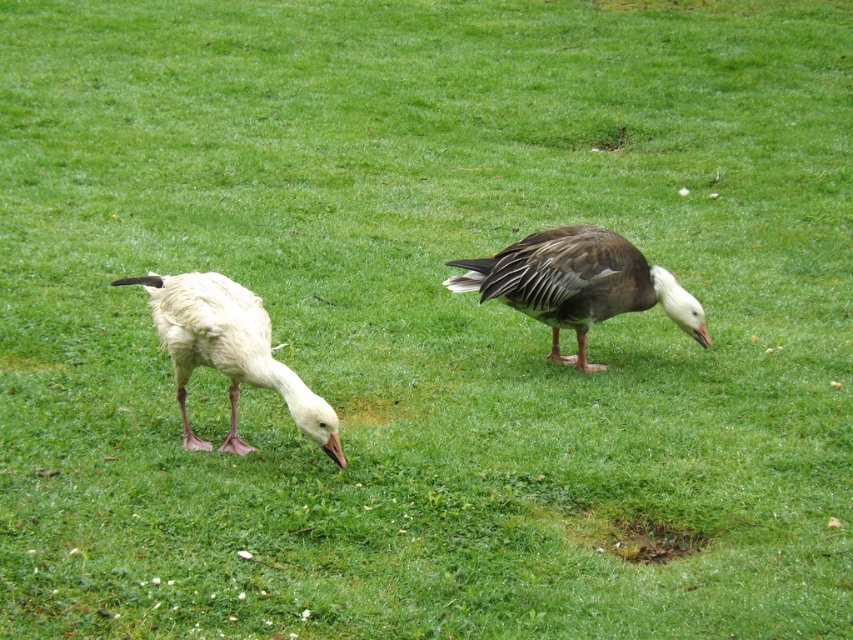
Question: Which object is farther from the camera taking this photo?

Choices:
 (A) white matte goose at left
 (B) brown feathered duck at center

Answer: (B)

Question: Is brown feathered duck at center behind white matte goose at left?

Choices:
 (A) yes
 (B) no

Answer: (A)

Question: Does brown feathered duck at center appear under white matte goose at left?

Choices:
 (A) yes
 (B) no

Answer: (B)

Question: Does brown feathered duck at center have a smaller size compared to white matte goose at left?

Choices:
 (A) yes
 (B) no

Answer: (B)

Question: Which object appears closest to the camera in this image?

Choices:
 (A) brown feathered duck at center
 (B) white matte goose at left

Answer: (B)

Question: Which object is farther from the camera taking this photo?

Choices:
 (A) white matte goose at left
 (B) brown feathered duck at center

Answer: (B)